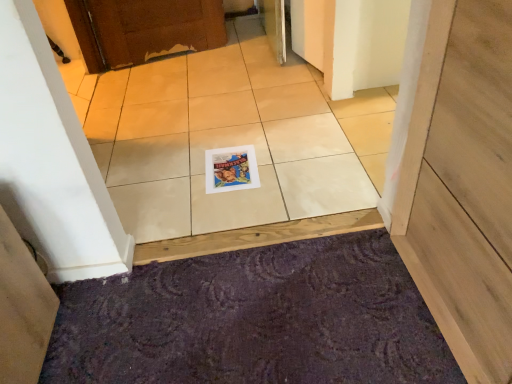
Question: From a real-world perspective, is white glossy tile at center physically located above or below matte paper magazine at center?

Choices:
 (A) above
 (B) below

Answer: (A)

Question: Considering their positions, is white glossy tile at center located in front of or behind matte paper magazine at center?

Choices:
 (A) front
 (B) behind

Answer: (A)

Question: Based on their relative distances, which object is nearer to the white glossy tile at center?

Choices:
 (A) purple textured doormat at lower center
 (B) matte paper magazine at center

Answer: (B)

Question: Estimate the real-world distances between objects in this image. Which object is closer to the matte paper magazine at center?

Choices:
 (A) white glossy tile at center
 (B) purple textured doormat at lower center

Answer: (A)